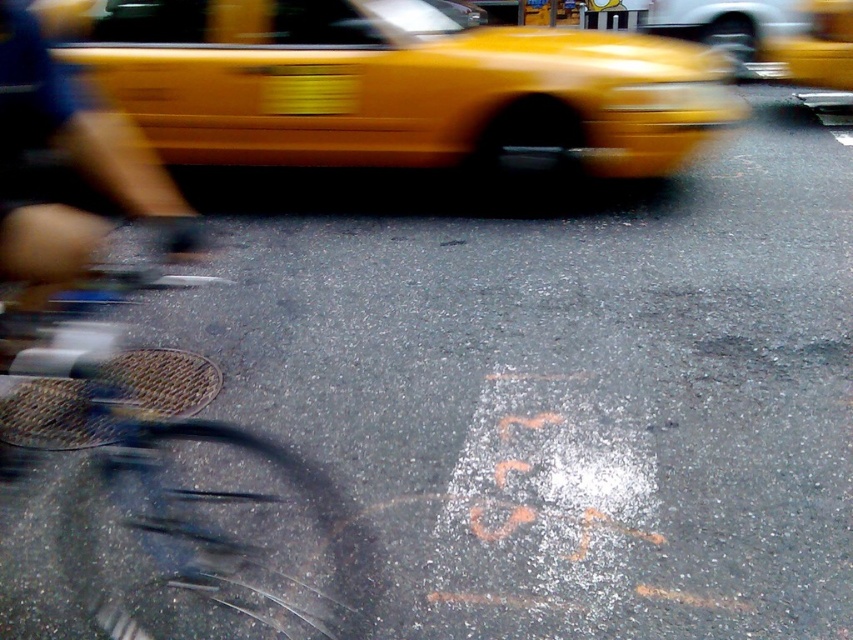
Does yellow plastic taxi at upper center appear under yellow rubber taxi at upper right?

Yes.

Does yellow plastic taxi at upper center appear on the right side of yellow rubber taxi at upper right?

In fact, yellow plastic taxi at upper center is to the left of yellow rubber taxi at upper right.

Is point (160, 22) positioned in front of point (769, 42)?

Yes.

The width and height of the screenshot is (853, 640). In order to click on yellow plastic taxi at upper center in this screenshot , I will do `click(393, 86)`.

You are a GUI agent. You are given a task and a screenshot of the screen. Output one action in this format:
    pyautogui.click(x=<x>, y=<y>)
    Task: Click on the yellow plastic taxi at upper center
    
    Given the screenshot: What is the action you would take?
    pyautogui.click(x=393, y=86)

The width and height of the screenshot is (853, 640). What are the coordinates of `yellow plastic taxi at upper center` in the screenshot? It's located at (393, 86).

In the scene shown: Is blue metallic bicycle at lower left positioned at the back of yellow rubber taxi at upper right?

No, blue metallic bicycle at lower left is in front of yellow rubber taxi at upper right.

Does blue metallic bicycle at lower left appear on the right side of yellow rubber taxi at upper right?

No, blue metallic bicycle at lower left is not to the right of yellow rubber taxi at upper right.

Is point (154, 282) farther from camera compared to point (836, 3)?

No, (154, 282) is closer to viewer.

You are a GUI agent. You are given a task and a screenshot of the screen. Output one action in this format:
    pyautogui.click(x=<x>, y=<y>)
    Task: Click on the blue metallic bicycle at lower left
    This screenshot has width=853, height=640.
    Given the screenshot: What is the action you would take?
    pyautogui.click(x=184, y=515)